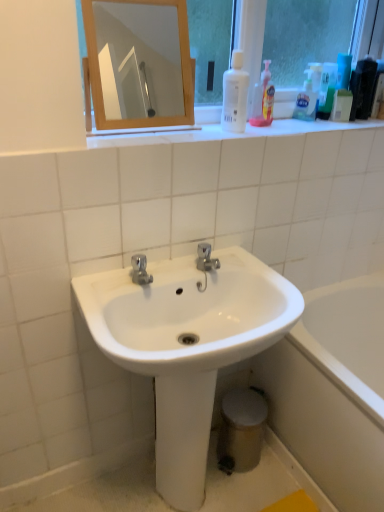
Question: Is white glossy sink at center surrounding white glossy bathtub at lower right?

Choices:
 (A) yes
 (B) no

Answer: (B)

Question: Can you confirm if white glossy sink at center is positioned to the right of white glossy bathtub at lower right?

Choices:
 (A) yes
 (B) no

Answer: (B)

Question: Is white glossy sink at center next to white glossy bathtub at lower right and touching it?

Choices:
 (A) no
 (B) yes

Answer: (A)

Question: Is white glossy sink at center bigger than white glossy bathtub at lower right?

Choices:
 (A) yes
 (B) no

Answer: (B)

Question: From a real-world perspective, is white glossy sink at center below white glossy bathtub at lower right?

Choices:
 (A) yes
 (B) no

Answer: (B)

Question: Considering their positions, is translucent plastic bottle at upper right, which is the 2th cleaning product from right to left, located in front of or behind white glossy bathtub at lower right?

Choices:
 (A) front
 (B) behind

Answer: (B)

Question: Considering the positions of translucent plastic bottle at upper right, which is the 2th cleaning product from right to left, and white glossy bathtub at lower right in the image, is translucent plastic bottle at upper right, which is the 2th cleaning product from right to left, bigger or smaller than white glossy bathtub at lower right?

Choices:
 (A) big
 (B) small

Answer: (B)

Question: Considering the positions of point (261, 105) and point (306, 457), is point (261, 105) closer or farther from the camera than point (306, 457)?

Choices:
 (A) farther
 (B) closer

Answer: (B)

Question: Visually, is translucent plastic bottle at upper right, which is the 2th cleaning product from right to left, positioned to the left or to the right of white glossy bathtub at lower right?

Choices:
 (A) right
 (B) left

Answer: (B)

Question: From the image's perspective, is white glossy bottle at upper center, the third cleaning product from the right, located above or below wooden mirror at upper center?

Choices:
 (A) above
 (B) below

Answer: (B)

Question: Is point (x=238, y=95) positioned closer to the camera than point (x=105, y=28)?

Choices:
 (A) closer
 (B) farther

Answer: (A)

Question: Considering their positions, is white glossy bottle at upper center, the third cleaning product from the right, located in front of or behind wooden mirror at upper center?

Choices:
 (A) behind
 (B) front

Answer: (A)

Question: Based on their sizes in the image, would you say white glossy bottle at upper center, which is the first cleaning product in left-to-right order, is bigger or smaller than wooden mirror at upper center?

Choices:
 (A) small
 (B) big

Answer: (A)

Question: Is point (379, 297) positioned closer to the camera than point (309, 102)?

Choices:
 (A) closer
 (B) farther

Answer: (B)

Question: Is white glossy bathtub at lower right in front of or behind translucent plastic soap dispenser at upper right, which ranks as the 3th cleaning product in left-to-right order, in the image?

Choices:
 (A) behind
 (B) front

Answer: (B)